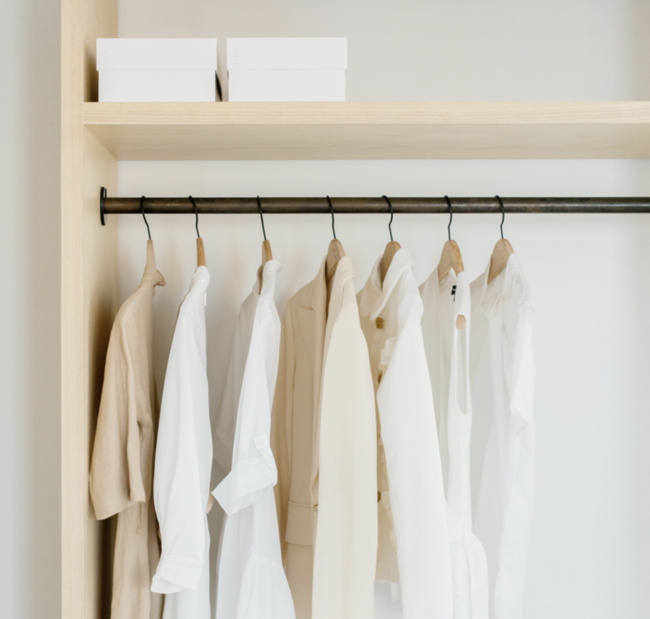
The height and width of the screenshot is (619, 650). What are the coordinates of `hanger` in the screenshot? It's located at (151, 232), (200, 233), (265, 240), (333, 241), (387, 233), (445, 235), (500, 230).